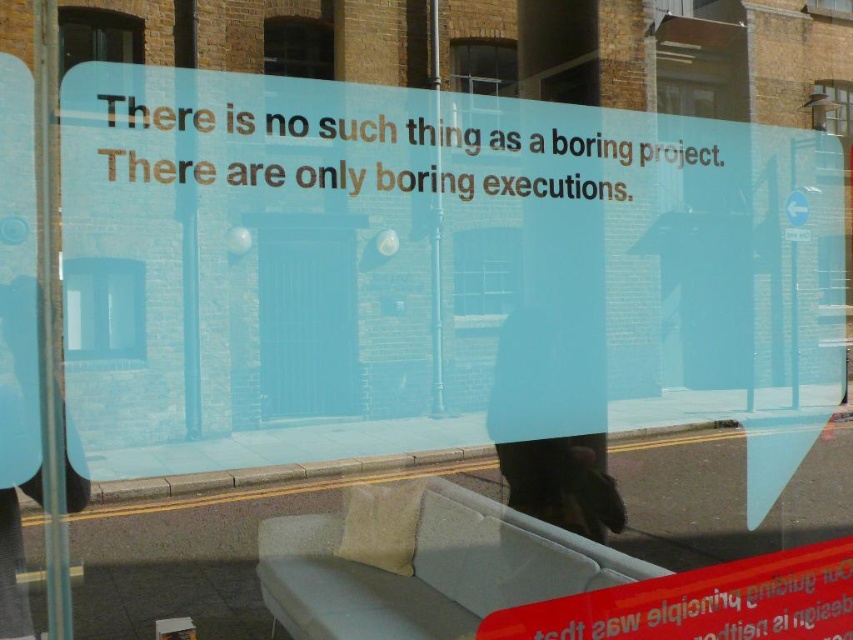
The image size is (853, 640). What do you see at coordinates (299, 48) in the screenshot?
I see `matte glass window at upper center` at bounding box center [299, 48].

Is the position of matte glass window at upper center less distant than that of transparent glass window at upper center?

Yes, it is.

The width and height of the screenshot is (853, 640). Find the location of `matte glass window at upper center`. matte glass window at upper center is located at coordinates (299, 48).

Between clear glass window at center and dark glass window at upper left, which one has less height?

dark glass window at upper left is shorter.

Is point (476, 321) positioned in front of point (71, 38)?

No, (476, 321) is behind (71, 38).

The image size is (853, 640). Identify the location of clear glass window at center. (485, 275).

Between transparent glass window at center and clear glass window at center, which one appears on the left side from the viewer's perspective?

From the viewer's perspective, transparent glass window at center appears more on the left side.

Is point (108, 282) less distant than point (494, 285)?

Yes.

This screenshot has height=640, width=853. Find the location of `transparent glass window at center`. transparent glass window at center is located at coordinates (103, 308).